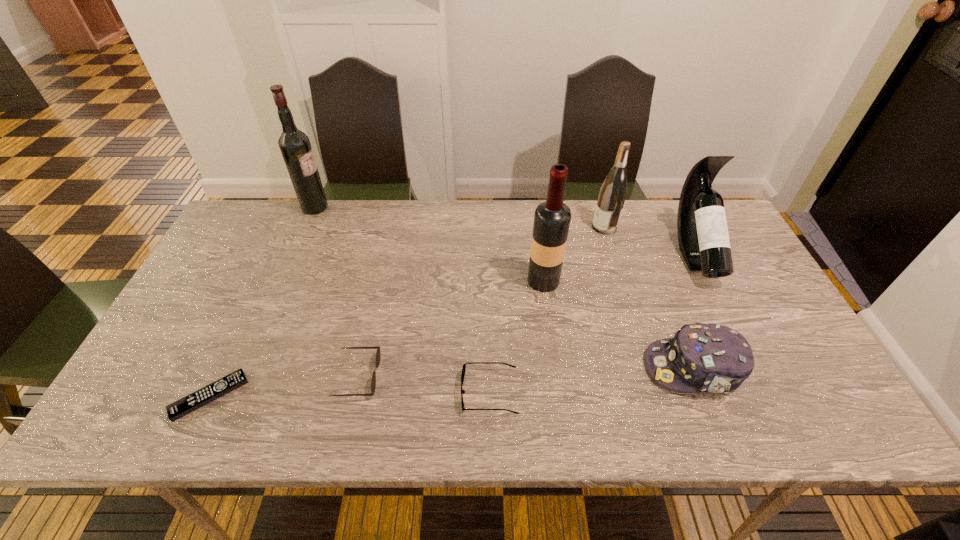
Locate an element on the screen. This screenshot has height=540, width=960. object present at the far right corner is located at coordinates (703, 237).

Find the location of a particular element. Image resolution: width=960 pixels, height=540 pixels. vacant point at the far edge is located at coordinates (578, 247).

I want to click on free space at the near edge, so click(x=447, y=407).

In the image, there is a desktop. At what (x,y) coordinates should I click in order to perform the action: click on free space at the right edge. Please return your answer as a coordinate pair (x, y). Image resolution: width=960 pixels, height=540 pixels. Looking at the image, I should click on point(747,269).

At what (x,y) coordinates should I click in order to perform the action: click on free region at the far left corner of the desktop. Please return your answer as a coordinate pair (x, y). The image size is (960, 540). Looking at the image, I should click on (236, 235).

At what (x,y) coordinates should I click in order to perform the action: click on free spot at the near left corner of the desktop. Please return your answer as a coordinate pair (x, y). The width and height of the screenshot is (960, 540). Looking at the image, I should click on (167, 416).

I want to click on free region at the near right corner, so click(796, 422).

Identify the location of vacant area that lies between the third wine bottle from right to left and the farthest wine bottle. (429, 244).

Identify the location of empty location between the fourth shortest object and the second wine bottle from right to left. The width and height of the screenshot is (960, 540). (649, 298).

Locate an element on the screen. unoccupied area between the second wine bottle from right to left and the third wine bottle from right to left is located at coordinates coord(574,254).